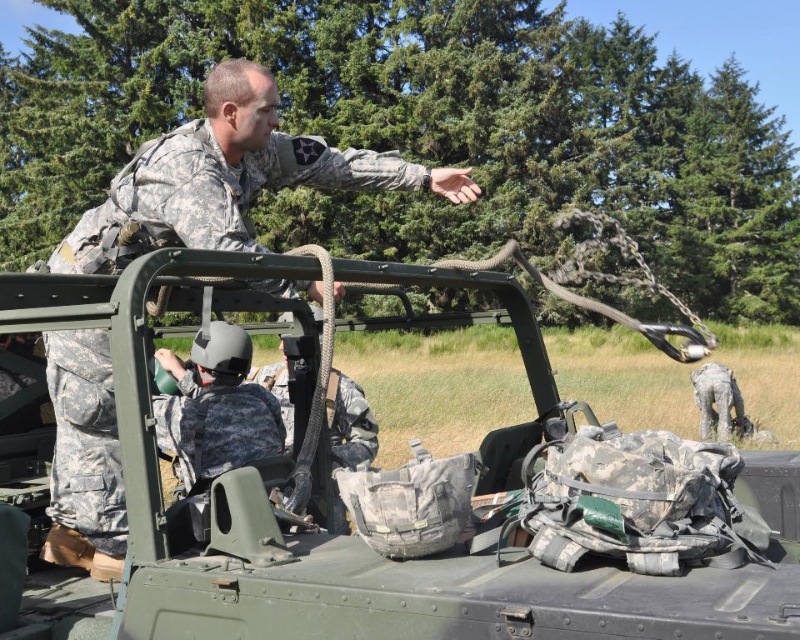
In the image, there is a camouflage fabric tank at upper center. What are the coordinates of its position?

The camouflage fabric tank at upper center is located at coordinates point (409, 492).

Consider the image. You are a military observer trying to locate two objects in the image. The camouflage fabric tank at upper center and the camouflage uniform at upper left. Based on their positions, which one is positioned to the east?

The camouflage fabric tank at upper center is to the right of camouflage uniform at upper left, so it is positioned to the east.

You are a military analyst observing the scene. You notice the camouflage fabric tank at upper center and the camouflage uniform at upper left. Which object is closer to the front of the image?

The camouflage fabric tank at upper center is closer to the front of the image because it is positioned in front of the camouflage uniform at upper left.